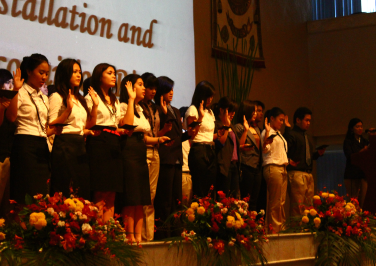
Identify the location of decorative wall hanging. This screenshot has width=376, height=266. (233, 26).